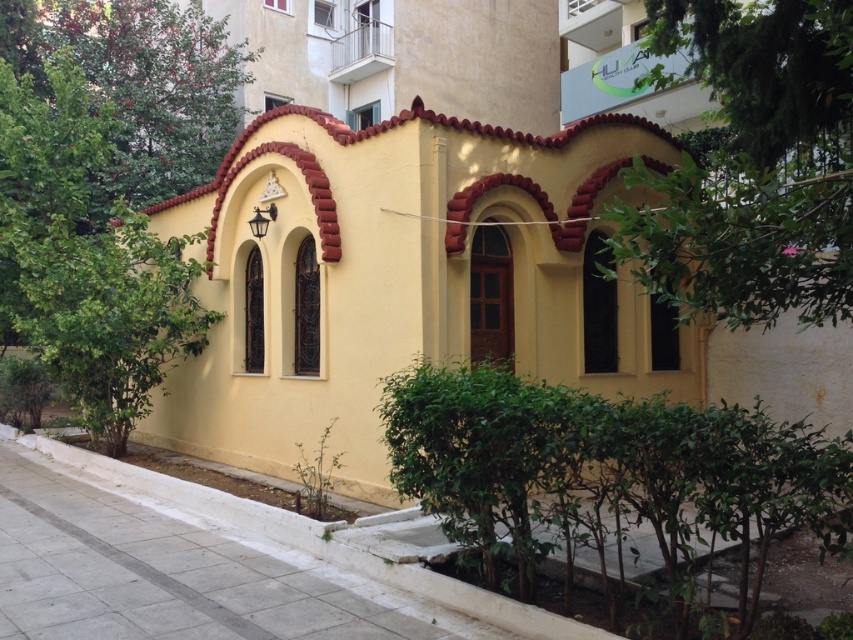
Question: Can you confirm if yellow matte building at center is positioned to the left of green leafy tree at center?

Choices:
 (A) no
 (B) yes

Answer: (A)

Question: Is yellow matte building at center positioned in front of green leafy tree at upper left?

Choices:
 (A) no
 (B) yes

Answer: (B)

Question: Which point is farther from the camera taking this photo?

Choices:
 (A) (239, 241)
 (B) (817, 97)
 (C) (134, 237)
 (D) (164, 552)

Answer: (A)

Question: Is yellow matte building at center wider than white concrete pavement at lower center?

Choices:
 (A) yes
 (B) no

Answer: (B)

Question: Among these points, which one is nearest to the camera?

Choices:
 (A) (15, 68)
 (B) (238, 61)
 (C) (346, 586)
 (D) (561, 170)

Answer: (C)

Question: Which object is closer to the camera taking this photo?

Choices:
 (A) white concrete pavement at lower center
 (B) green leafy tree at center
 (C) green leafy tree at upper left
 (D) green leafy tree at upper right

Answer: (A)